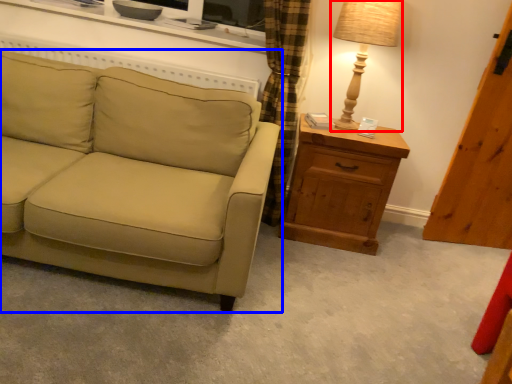
Question: Among these objects, which one is farthest to the camera, table lamp (highlighted by a red box) or studio couch (highlighted by a blue box)?

Choices:
 (A) table lamp
 (B) studio couch

Answer: (A)